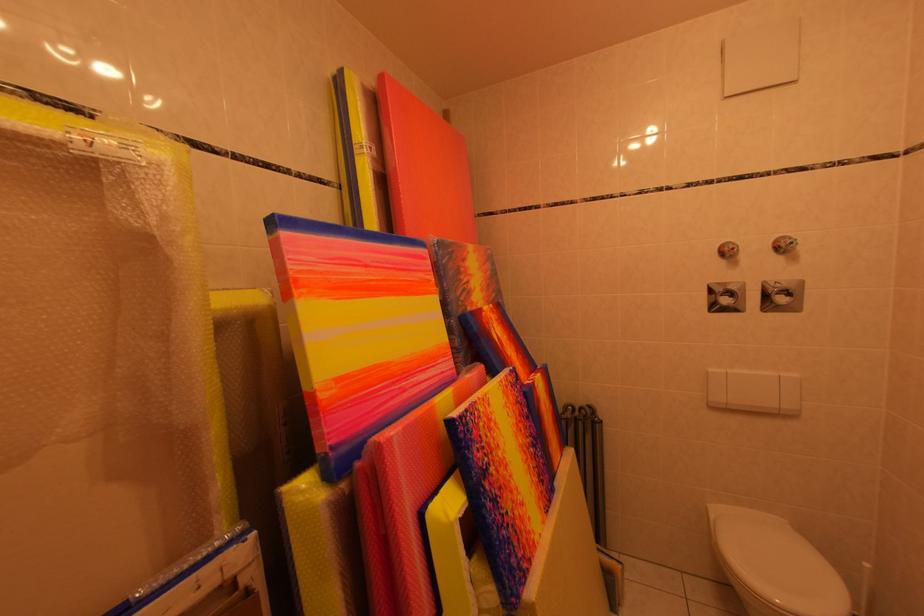
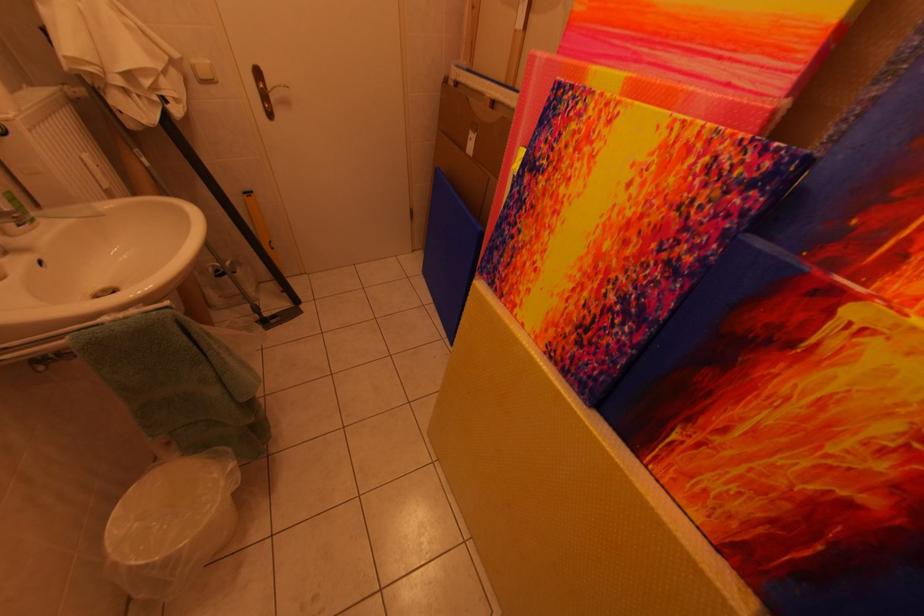
In the second image, find the point that corresponds to (x=504, y=458) in the first image.

(565, 180)